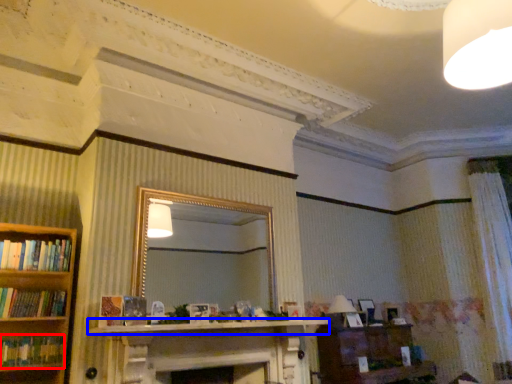
Question: Among these objects, which one is nearest to the camera, book (highlighted by a red box) or mantle (highlighted by a blue box)?

Choices:
 (A) book
 (B) mantle

Answer: (B)